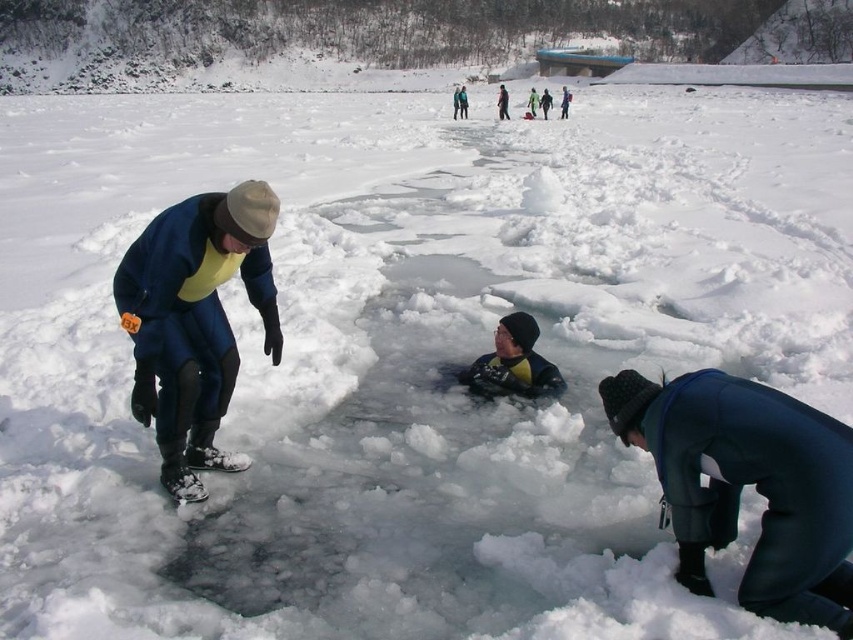
Question: Is yellow rubber boots at center behind yellow-green wetsuit at center?

Choices:
 (A) no
 (B) yes

Answer: (A)

Question: Does matte blue snowsuit at left have a greater width compared to yellow rubber suit at center?

Choices:
 (A) yes
 (B) no

Answer: (B)

Question: Which of the following is the farthest from the observer?

Choices:
 (A) (531, 100)
 (B) (798, 557)
 (C) (561, 116)
 (D) (181, 310)

Answer: (A)

Question: Which point is closer to the camera taking this photo?

Choices:
 (A) (x=531, y=97)
 (B) (x=550, y=100)
 (C) (x=563, y=116)

Answer: (C)

Question: Which of these objects is positioned closest to the yellow rubber boots at center?

Choices:
 (A) blue waterproof suit at center
 (B) yellow rubber suit at center
 (C) yellow-green wetsuit at center

Answer: (B)

Question: Does dark blue waterproof suit at lower right come behind yellow rubber boots at center?

Choices:
 (A) yes
 (B) no

Answer: (B)